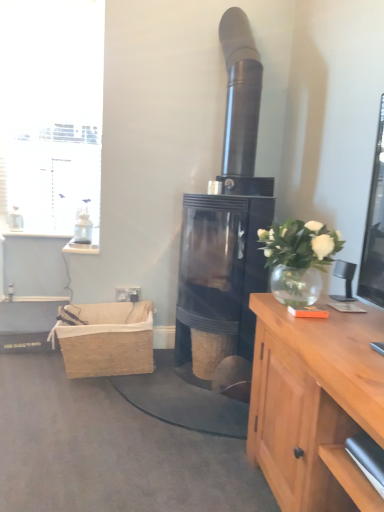
The width and height of the screenshot is (384, 512). I want to click on free space that is in between black glass fireplace at center and burlap picnic basket at lower left, so click(134, 385).